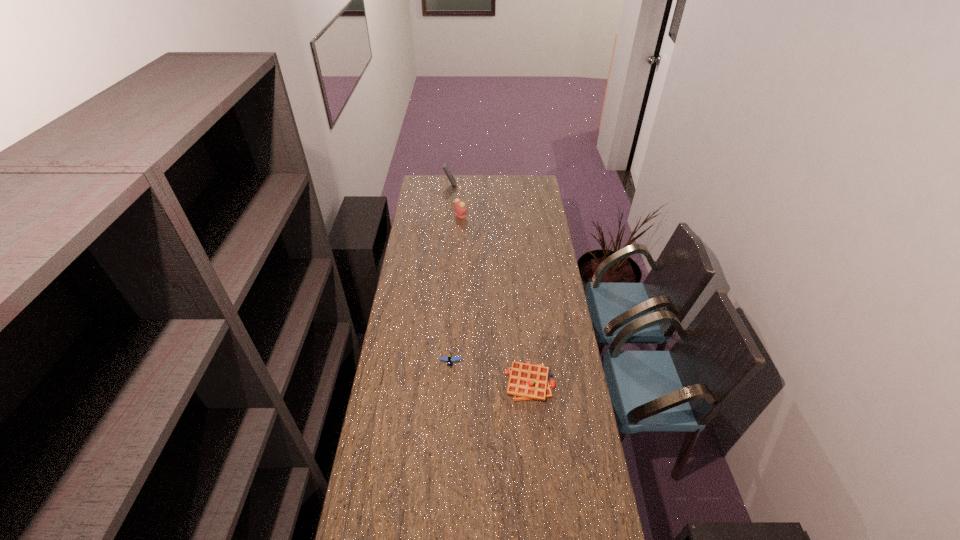
This screenshot has height=540, width=960. Find the location of `the tallest object`. the tallest object is located at coordinates (444, 166).

Identify the location of the farthest object. (444, 166).

Where is `alarm clock`? Image resolution: width=960 pixels, height=540 pixels. alarm clock is located at coordinates (460, 209).

Locate an element on the screen. This screenshot has width=960, height=540. the third nearest object is located at coordinates (460, 209).

Locate an element on the screen. the second shortest object is located at coordinates (449, 358).

Image resolution: width=960 pixels, height=540 pixels. I want to click on waffle, so click(x=526, y=382).

Identify the location of the rightmost object. The image size is (960, 540). (526, 382).

Image resolution: width=960 pixels, height=540 pixels. I want to click on vacant space situated 0.120m on the front-facing side of the tallest object, so click(475, 185).

Locate an element on the screen. The height and width of the screenshot is (540, 960). vacant position located on the face of the second farthest object is located at coordinates (531, 215).

The height and width of the screenshot is (540, 960). I want to click on vacant area situated on the front-facing side of the Lego, so click(447, 425).